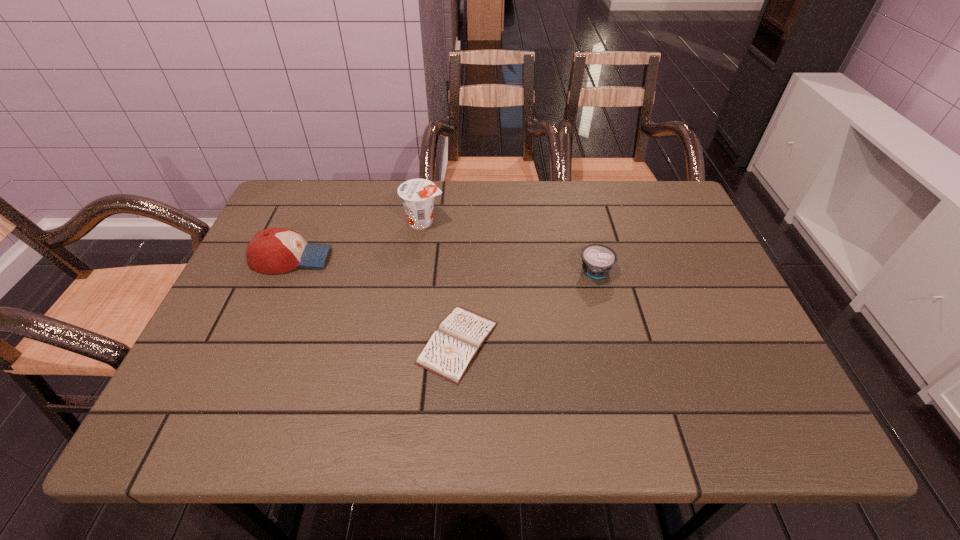
The width and height of the screenshot is (960, 540). Find the location of `empty space that is in between the nearer yogurt and the farther yogurt`. empty space that is in between the nearer yogurt and the farther yogurt is located at coordinates (510, 247).

The width and height of the screenshot is (960, 540). Find the location of `free area in between the shortest object and the farther yogurt`. free area in between the shortest object and the farther yogurt is located at coordinates (441, 282).

Where is `blank region between the third shortest object and the nearest object`? blank region between the third shortest object and the nearest object is located at coordinates (374, 301).

At what (x,y) coordinates should I click in order to perform the action: click on unoccupied area between the baseball cap and the second shortest object. Please return your answer as a coordinate pair (x, y). The width and height of the screenshot is (960, 540). Looking at the image, I should click on (444, 265).

Where is `free point between the nearest object and the taller yogurt`? free point between the nearest object and the taller yogurt is located at coordinates (441, 282).

Image resolution: width=960 pixels, height=540 pixels. I want to click on unoccupied area between the leftmost object and the rightmost object, so click(x=444, y=265).

This screenshot has width=960, height=540. In order to click on free point between the rightmost object and the nearest object in this screenshot , I will do `click(527, 307)`.

Where is `vacant space that is in between the nearest object and the second tallest object`? vacant space that is in between the nearest object and the second tallest object is located at coordinates (374, 301).

In order to click on vacant space that's between the right yogurt and the diary in this screenshot , I will do `click(527, 307)`.

Find the location of a particular element. The image size is (960, 540). object that ranks as the third closest to the shortest object is located at coordinates (275, 250).